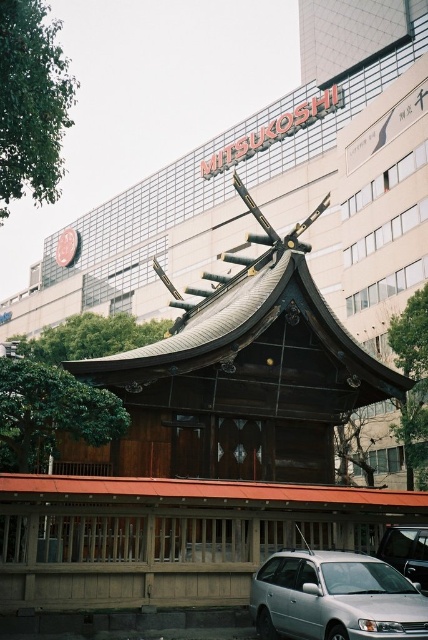
You are a delivery driver who needs to park your silver metallic car at lower center near the shrine. Based on the coordinates given, can you estimate if the car will fit between the shrine and the modern building without blocking the entrance?

The silver metallic car at lower center is located at point coordinates, but without knowing the dimensions of the shrine and the modern building, it is impossible to determine if the car will fit between them without blocking the entrance.